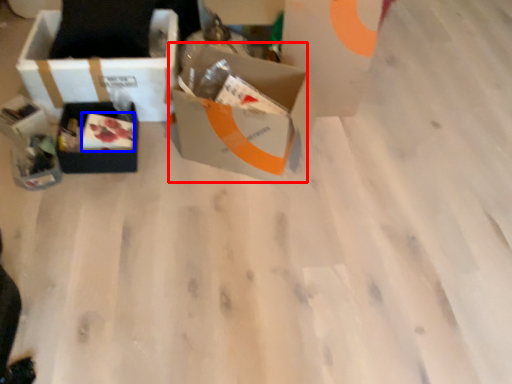
Question: Which object is closer to the camera taking this photo, box (highlighted by a red box) or food (highlighted by a blue box)?

Choices:
 (A) box
 (B) food

Answer: (A)